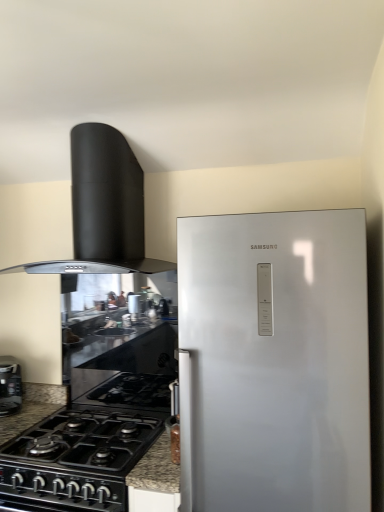
Question: Can you confirm if black glass countertop at center is thinner than black matte/glossy gas stove at lower left?

Choices:
 (A) yes
 (B) no

Answer: (A)

Question: Can you confirm if black glass countertop at center is smaller than black matte/glossy gas stove at lower left?

Choices:
 (A) yes
 (B) no

Answer: (A)

Question: Would you say black matte/glossy gas stove at lower left is part of black glass countertop at center's contents?

Choices:
 (A) no
 (B) yes

Answer: (A)

Question: Can we say black glass countertop at center lies outside black matte/glossy gas stove at lower left?

Choices:
 (A) no
 (B) yes

Answer: (B)

Question: Considering the relative sizes of black glass countertop at center and black matte/glossy gas stove at lower left in the image provided, is black glass countertop at center shorter than black matte/glossy gas stove at lower left?

Choices:
 (A) no
 (B) yes

Answer: (A)

Question: In terms of height, does black matte/glossy gas stove at lower left look taller or shorter compared to black matte range hood at upper left?

Choices:
 (A) short
 (B) tall

Answer: (A)

Question: In terms of size, does black matte/glossy gas stove at lower left appear bigger or smaller than black matte range hood at upper left?

Choices:
 (A) small
 (B) big

Answer: (A)

Question: Does point (49, 470) appear closer or farther from the camera than point (112, 217)?

Choices:
 (A) closer
 (B) farther

Answer: (A)

Question: From the image's perspective, is black matte/glossy gas stove at lower left located above or below black matte range hood at upper left?

Choices:
 (A) above
 (B) below

Answer: (B)

Question: From the image's perspective, is black glass countertop at center above or below black matte range hood at upper left?

Choices:
 (A) above
 (B) below

Answer: (B)

Question: In terms of width, does black glass countertop at center look wider or thinner when compared to black matte range hood at upper left?

Choices:
 (A) wide
 (B) thin

Answer: (B)

Question: From a real-world perspective, relative to black matte range hood at upper left, is black glass countertop at center vertically above or below?

Choices:
 (A) below
 (B) above

Answer: (A)

Question: Is black glass countertop at center bigger or smaller than black matte range hood at upper left?

Choices:
 (A) big
 (B) small

Answer: (B)

Question: Is black glossy toaster at lower left in front of or behind black matte/glossy gas stove at lower left in the image?

Choices:
 (A) behind
 (B) front

Answer: (A)

Question: Is black glossy toaster at lower left taller or shorter than black matte/glossy gas stove at lower left?

Choices:
 (A) short
 (B) tall

Answer: (B)